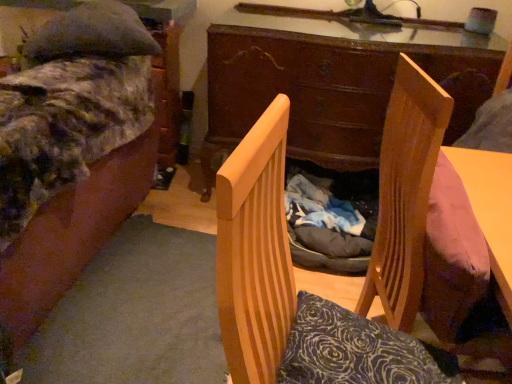
Question: From a real-world perspective, does velvet-like fabric bed at left stand above wooden chair at center?

Choices:
 (A) no
 (B) yes

Answer: (A)

Question: Considering the relative sizes of velvet-like fabric bed at left and wooden chair at center in the image provided, is velvet-like fabric bed at left thinner than wooden chair at center?

Choices:
 (A) no
 (B) yes

Answer: (A)

Question: Would you consider velvet-like fabric bed at left to be distant from wooden chair at center?

Choices:
 (A) yes
 (B) no

Answer: (B)

Question: Can you confirm if velvet-like fabric bed at left is taller than wooden chair at center?

Choices:
 (A) no
 (B) yes

Answer: (B)

Question: Is velvet-like fabric bed at left surrounding wooden chair at center?

Choices:
 (A) yes
 (B) no

Answer: (B)

Question: In the image, is velvet-like fabric bed at left on the left side or the right side of wooden desk at center?

Choices:
 (A) right
 (B) left

Answer: (B)

Question: Choose the correct answer: Is velvet-like fabric bed at left inside wooden desk at center or outside it?

Choices:
 (A) outside
 (B) inside

Answer: (A)

Question: Considering their positions, is velvet-like fabric bed at left located in front of or behind wooden desk at center?

Choices:
 (A) front
 (B) behind

Answer: (A)

Question: Looking at the image, does velvet-like fabric bed at left seem bigger or smaller compared to wooden desk at center?

Choices:
 (A) small
 (B) big

Answer: (B)

Question: Is wooden desk at center taller or shorter than wooden chair at center?

Choices:
 (A) short
 (B) tall

Answer: (B)

Question: From the image's perspective, is wooden desk at center located above or below wooden chair at center?

Choices:
 (A) above
 (B) below

Answer: (A)

Question: Is point (236, 94) closer or farther from the camera than point (397, 339)?

Choices:
 (A) farther
 (B) closer

Answer: (A)

Question: Relative to wooden chair at center, is wooden desk at center in front or behind?

Choices:
 (A) behind
 (B) front

Answer: (A)

Question: Is wooden chair at center inside the boundaries of velvet-like fabric bed at left, or outside?

Choices:
 (A) inside
 (B) outside

Answer: (B)

Question: From a real-world perspective, is wooden chair at center positioned above or below velvet-like fabric bed at left?

Choices:
 (A) above
 (B) below

Answer: (A)